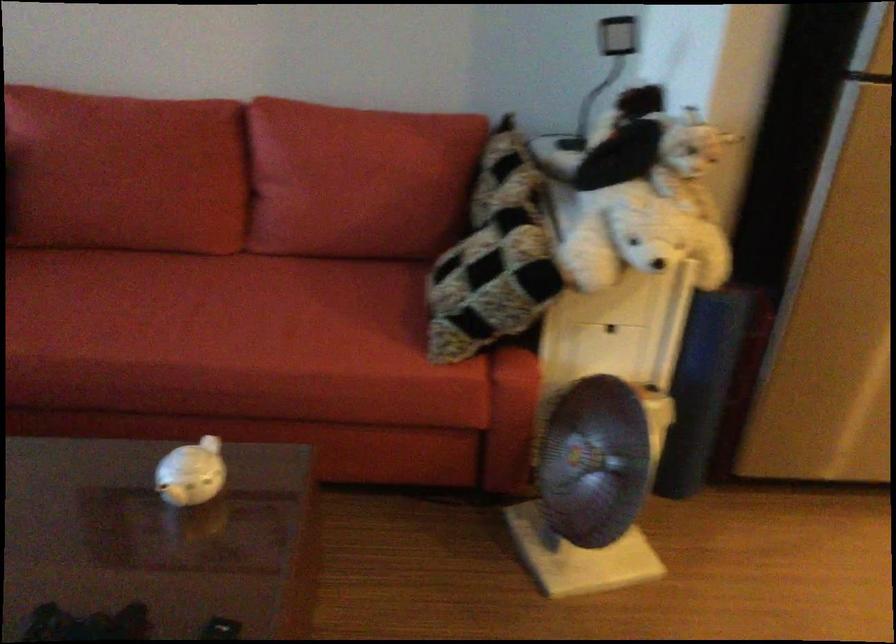
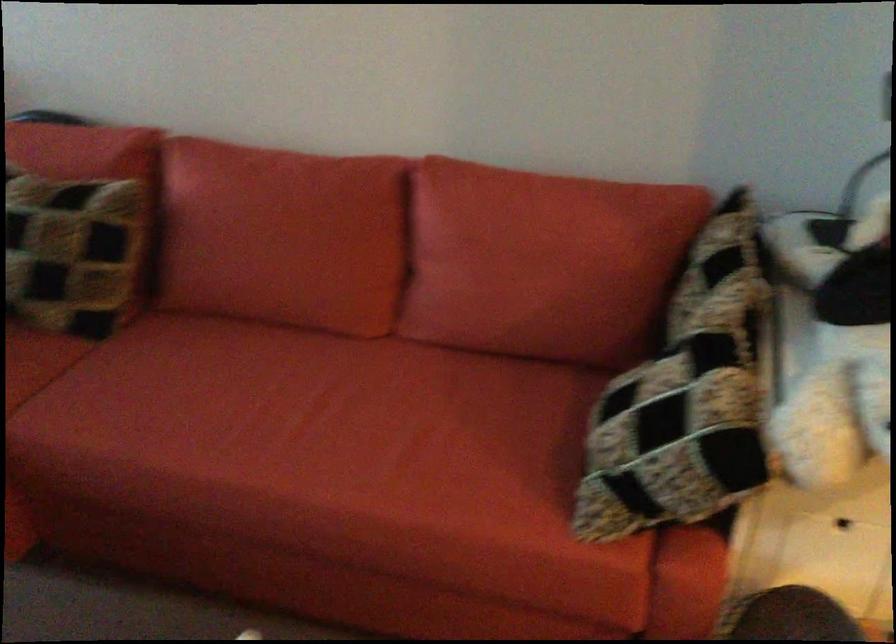
Find the pixel in the second image that matches point (367, 183) in the first image.

(538, 270)